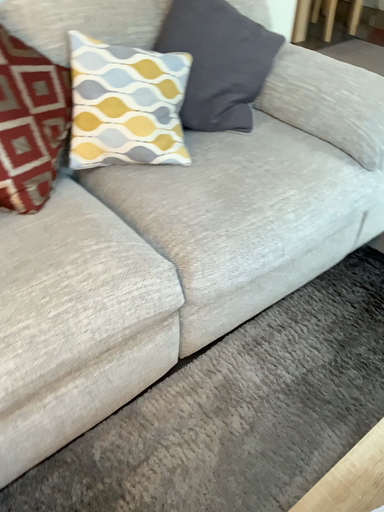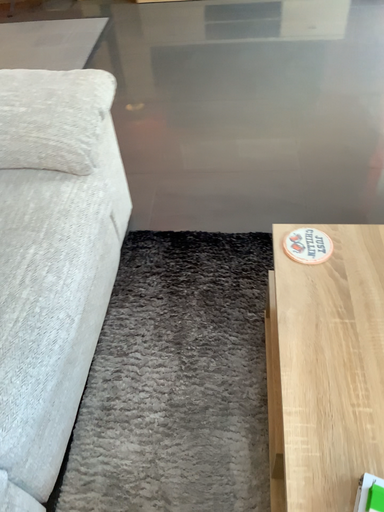
Question: Which way did the camera rotate in the video?

Choices:
 (A) rotated left
 (B) rotated right

Answer: (B)